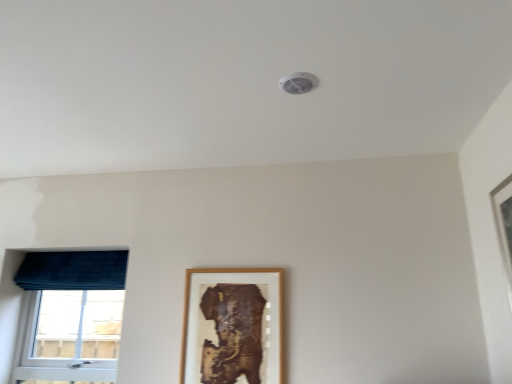
Question: Is velvet blue curtain at left behind velvet blue window at left?

Choices:
 (A) no
 (B) yes

Answer: (B)

Question: Can you confirm if velvet blue curtain at left is shorter than velvet blue window at left?

Choices:
 (A) no
 (B) yes

Answer: (B)

Question: Is velvet blue curtain at left positioned beyond the bounds of velvet blue window at left?

Choices:
 (A) no
 (B) yes

Answer: (B)

Question: From a real-world perspective, is velvet blue curtain at left positioned over velvet blue window at left based on gravity?

Choices:
 (A) no
 (B) yes

Answer: (B)

Question: Does velvet blue curtain at left have a smaller size compared to velvet blue window at left?

Choices:
 (A) yes
 (B) no

Answer: (A)

Question: Is velvet blue window at left at the back of velvet blue curtain at left?

Choices:
 (A) yes
 (B) no

Answer: (A)

Question: Is wooden picture frame at center smaller than velvet blue window at left?

Choices:
 (A) no
 (B) yes

Answer: (B)

Question: Is wooden picture frame at center to the left of velvet blue window at left from the viewer's perspective?

Choices:
 (A) yes
 (B) no

Answer: (B)

Question: From a real-world perspective, is wooden picture frame at center physically above velvet blue window at left?

Choices:
 (A) yes
 (B) no

Answer: (B)

Question: Considering the relative sizes of wooden picture frame at center and velvet blue window at left in the image provided, is wooden picture frame at center taller than velvet blue window at left?

Choices:
 (A) no
 (B) yes

Answer: (A)

Question: Is wooden picture frame at center oriented towards velvet blue window at left?

Choices:
 (A) no
 (B) yes

Answer: (A)

Question: From the image's perspective, would you say wooden picture frame at center is shown under velvet blue window at left?

Choices:
 (A) yes
 (B) no

Answer: (B)

Question: Does velvet blue window at left have a lesser width compared to velvet blue curtain at left?

Choices:
 (A) no
 (B) yes

Answer: (B)